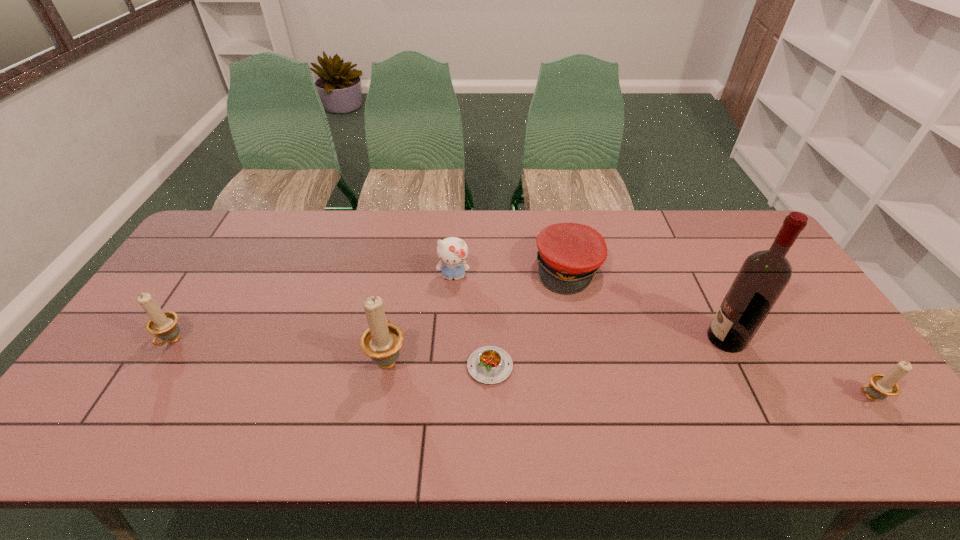
Identify the location of vacant region at the far edge of the desktop. The width and height of the screenshot is (960, 540). (266, 251).

In the image, there is a desktop. Where is `vacant space at the near edge`? vacant space at the near edge is located at coordinates (687, 383).

Where is `free space at the left edge of the desktop`? free space at the left edge of the desktop is located at coordinates (220, 259).

Find the location of `vacant region at the right edge of the desktop`. vacant region at the right edge of the desktop is located at coordinates (774, 320).

In the image, there is a desktop. Identify the location of free space at the near right corner. (821, 384).

Where is `free space between the tallest object and the kitten`? free space between the tallest object and the kitten is located at coordinates [589, 308].

This screenshot has width=960, height=540. I want to click on vacant area between the shortest candle_holder and the kitten, so 660,337.

The image size is (960, 540). Find the location of `vacant area that lies between the alcohol and the shortest object`. vacant area that lies between the alcohol and the shortest object is located at coordinates (608, 353).

Find the location of `free space between the alcohol and the shortest object`. free space between the alcohol and the shortest object is located at coordinates (608, 353).

Where is `vacant area that lies between the shortest object and the tallest candle_holder`? Image resolution: width=960 pixels, height=540 pixels. vacant area that lies between the shortest object and the tallest candle_holder is located at coordinates (439, 363).